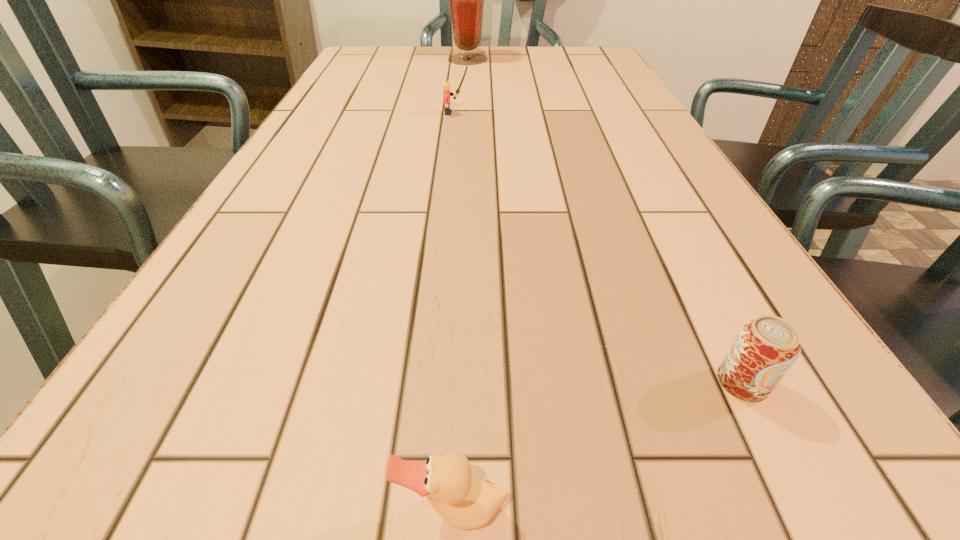
Where is `the farthest object`? Image resolution: width=960 pixels, height=540 pixels. the farthest object is located at coordinates (466, 0).

Find the location of a particular element. smoothie is located at coordinates (466, 0).

Identify the location of Lego. The height and width of the screenshot is (540, 960). (446, 85).

At what (x,y) coordinates should I click in order to perform the action: click on the rightmost object. Please return your answer as a coordinate pair (x, y). The width and height of the screenshot is (960, 540). Looking at the image, I should click on (766, 347).

Identify the location of beer can. (766, 347).

The height and width of the screenshot is (540, 960). In order to click on the nearest object in this screenshot , I will do `click(465, 502)`.

The width and height of the screenshot is (960, 540). Find the location of `free space located on the front of the tallest object`. free space located on the front of the tallest object is located at coordinates (464, 112).

Find the location of `vacant space located 0.180m on the front-facing side of the third nearest object`. vacant space located 0.180m on the front-facing side of the third nearest object is located at coordinates coord(544,113).

This screenshot has width=960, height=540. I want to click on blank space located 0.100m on the back of the third farthest object, so click(701, 301).

Where is `object that is positioned at the far edge`? The height and width of the screenshot is (540, 960). object that is positioned at the far edge is located at coordinates (466, 0).